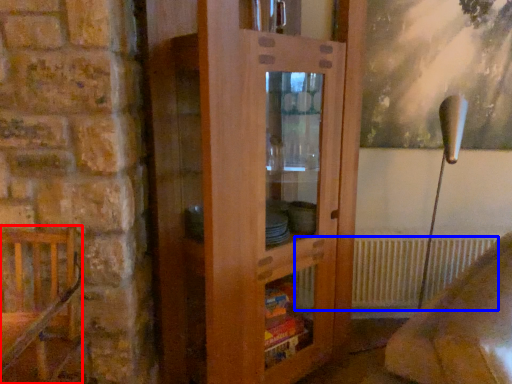
Question: Which point is further to the camera, furniture (highlighted by a red box) or radiator (highlighted by a blue box)?

Choices:
 (A) furniture
 (B) radiator

Answer: (B)